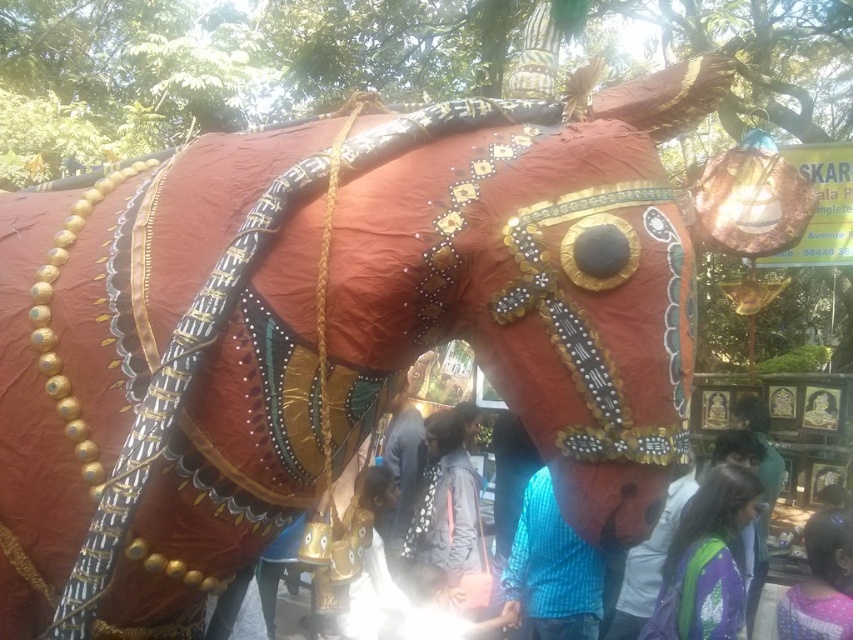
Is purple fabric at center to the left of purple fabric at lower right from the viewer's perspective?

Yes, purple fabric at center is to the left of purple fabric at lower right.

Can you confirm if purple fabric at center is wider than purple fabric at lower right?

Indeed, purple fabric at center has a greater width compared to purple fabric at lower right.

Where is `purple fabric at center`? The image size is (853, 640). purple fabric at center is located at coordinates (706, 561).

Looking at this image, who is shorter, purple fabric at center or blue checkered shirt at center?

With less height is purple fabric at center.

Is purple fabric at center bigger than blue checkered shirt at center?

Yes, purple fabric at center is bigger than blue checkered shirt at center.

Does point (750, 516) come in front of point (552, 522)?

Yes, point (750, 516) is in front of point (552, 522).

Locate an element on the screen. purple fabric at center is located at coordinates (706, 561).

Between blue checkered shirt at center and purple fabric at lower right, which one has less height?

purple fabric at lower right

Which is in front, point (544, 582) or point (828, 516)?

Point (828, 516) is in front.

Image resolution: width=853 pixels, height=640 pixels. In order to click on blue checkered shirt at center in this screenshot , I will do `click(552, 570)`.